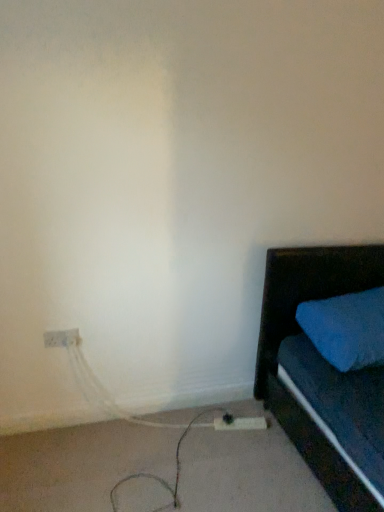
Where is `white plastic electric outlet at lower left`? The image size is (384, 512). white plastic electric outlet at lower left is located at coordinates (61, 338).

This screenshot has width=384, height=512. I want to click on white plastic extension cord at lower center, so click(241, 423).

Identify the location of white plastic electric outlet at lower left. (61, 338).

From a real-world perspective, is white plastic electric outlet at lower left physically below white plastic extension cord at lower center?

No.

Is white plastic electric outlet at lower left further to camera compared to white plastic extension cord at lower center?

No, the depth of white plastic electric outlet at lower left is less than that of white plastic extension cord at lower center.

Are white plastic electric outlet at lower left and white plastic extension cord at lower center making contact?

No, white plastic electric outlet at lower left is not in contact with white plastic extension cord at lower center.

Is white plastic electric outlet at lower left surrounding white plastic extension cord at lower center?

No, white plastic extension cord at lower center is not inside white plastic electric outlet at lower left.

Is white plastic extension cord at lower center in front of or behind white matte cable at lower left in the image?

Clearly, white plastic extension cord at lower center is behind white matte cable at lower left.

Is white plastic extension cord at lower center facing away from white matte cable at lower left?

No, white plastic extension cord at lower center is not facing away from white matte cable at lower left.

Is white plastic extension cord at lower center not close to white matte cable at lower left?

No.

Is white matte cable at lower left with white plastic electric outlet at lower left?

There is a gap between white matte cable at lower left and white plastic electric outlet at lower left.

Looking at their sizes, would you say white matte cable at lower left is wider or thinner than white plastic electric outlet at lower left?

Clearly, white matte cable at lower left has more width compared to white plastic electric outlet at lower left.

This screenshot has height=512, width=384. What are the coordinates of `concrete beneath the white plastic electric outlet at lower left (from a real-world perspective)` in the screenshot? It's located at (79, 465).

How different are the orientations of white matte cable at lower left and white plastic electric outlet at lower left in degrees?

The angular difference between white matte cable at lower left and white plastic electric outlet at lower left is 90.7 degrees.

Is white plastic electric outlet at lower left at the right side of white matte cable at lower left?

Incorrect, white plastic electric outlet at lower left is not on the right side of white matte cable at lower left.

Locate an element on the screen. This screenshot has width=384, height=512. electric outlet that is above the white matte cable at lower left (from a real-world perspective) is located at coordinates (61, 338).

In the scene shown: Is white matte cable at lower left at the back of white plastic electric outlet at lower left?

white plastic electric outlet at lower left does not have its back to white matte cable at lower left.

From the picture: From a real-world perspective, which is physically below, white plastic electric outlet at lower left or white matte cable at lower left?

In real-world perspective, white matte cable at lower left is lower.

Based on the photo, does white plastic extension cord at lower center come in front of white plastic electric outlet at lower left?

No, it is not.

Is white plastic extension cord at lower center to the left of white plastic electric outlet at lower left from the viewer's perspective?

No, white plastic extension cord at lower center is not to the left of white plastic electric outlet at lower left.

Is the surface of white plastic extension cord at lower center in direct contact with white plastic electric outlet at lower left?

No, white plastic extension cord at lower center is not with white plastic electric outlet at lower left.

You are a GUI agent. You are given a task and a screenshot of the screen. Output one action in this format:
    pyautogui.click(x=<x>, y=<y>)
    Task: Click on the electric outlet located in front of the white plastic extension cord at lower center
    
    Given the screenshot: What is the action you would take?
    pyautogui.click(x=61, y=338)

Locate an element on the screen. This screenshot has width=384, height=512. extension cord that appears behind the white matte cable at lower left is located at coordinates (241, 423).

Considering the positions of objects white matte cable at lower left and white plastic extension cord at lower center in the image provided, who is more to the right, white matte cable at lower left or white plastic extension cord at lower center?

From the viewer's perspective, white plastic extension cord at lower center appears more on the right side.

Can you see white matte cable at lower left touching white plastic extension cord at lower center?

They are not placed beside each other.

How many degrees apart are the facing directions of white matte cable at lower left and white plastic extension cord at lower center?

100 degrees separate the facing orientations of white matte cable at lower left and white plastic extension cord at lower center.

The width and height of the screenshot is (384, 512). Identify the location of electric outlet lying in front of the white plastic extension cord at lower center. (61, 338).

Locate an element on the screen. concrete below the white plastic extension cord at lower center (from a real-world perspective) is located at coordinates (x=79, y=465).

Looking at this image, when comparing their distances from white plastic electric outlet at lower left, does white plastic extension cord at lower center or white matte cable at lower left seem closer?

white matte cable at lower left lies closer to white plastic electric outlet at lower left than the other object.

Considering their positions, is white plastic electric outlet at lower left positioned closer to white plastic extension cord at lower center than white matte cable at lower left?

Among the two, white matte cable at lower left is located nearer to white plastic extension cord at lower center.

Which object lies nearer to the anchor point white matte cable at lower left, white plastic electric outlet at lower left or white plastic extension cord at lower center?

white plastic extension cord at lower center is closer to white matte cable at lower left.

Which object lies nearer to the anchor point white plastic extension cord at lower center, white matte cable at lower left or white plastic electric outlet at lower left?

The object closer to white plastic extension cord at lower center is white matte cable at lower left.

When comparing their distances from white matte cable at lower left, does white plastic extension cord at lower center or white plastic electric outlet at lower left seem further?

white plastic electric outlet at lower left.

Estimate the real-world distances between objects in this image. Which object is closer to white plastic electric outlet at lower left, white matte cable at lower left or white plastic extension cord at lower center?

Among the two, white matte cable at lower left is located nearer to white plastic electric outlet at lower left.

Image resolution: width=384 pixels, height=512 pixels. I want to click on concrete between white plastic electric outlet at lower left and white plastic extension cord at lower center, so click(x=79, y=465).